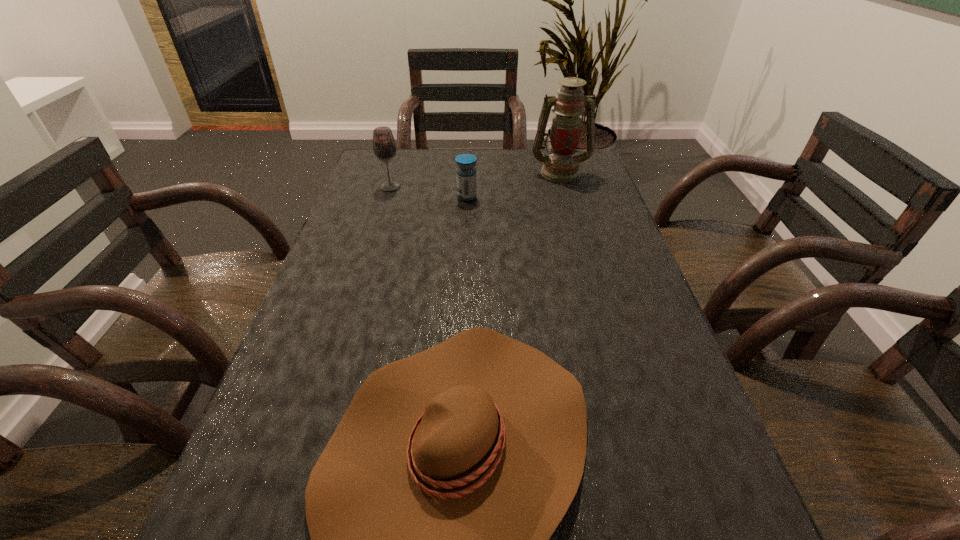
What are the coordinates of `object present at the far left corner` in the screenshot? It's located at (384, 146).

Identify the location of object positioned at the far right corner. The image size is (960, 540). pyautogui.click(x=561, y=166).

Image resolution: width=960 pixels, height=540 pixels. I want to click on free space at the far edge, so click(533, 157).

Find the location of a particular element. This screenshot has height=540, width=960. free location at the left edge is located at coordinates click(378, 239).

This screenshot has width=960, height=540. I want to click on blank space at the right edge, so click(589, 269).

Identify the location of free region at the far right corner of the desktop. This screenshot has height=540, width=960. (576, 152).

Where is `free space between the medicine and the tallest object`? The height and width of the screenshot is (540, 960). free space between the medicine and the tallest object is located at coordinates (514, 185).

Find the location of a particular element. The width and height of the screenshot is (960, 540). free space between the oil lamp and the medicine is located at coordinates (514, 185).

I want to click on free area in between the third tallest object and the tallest object, so click(x=514, y=185).

Find the location of `object that is the closest to the third tallest object`. object that is the closest to the third tallest object is located at coordinates (384, 146).